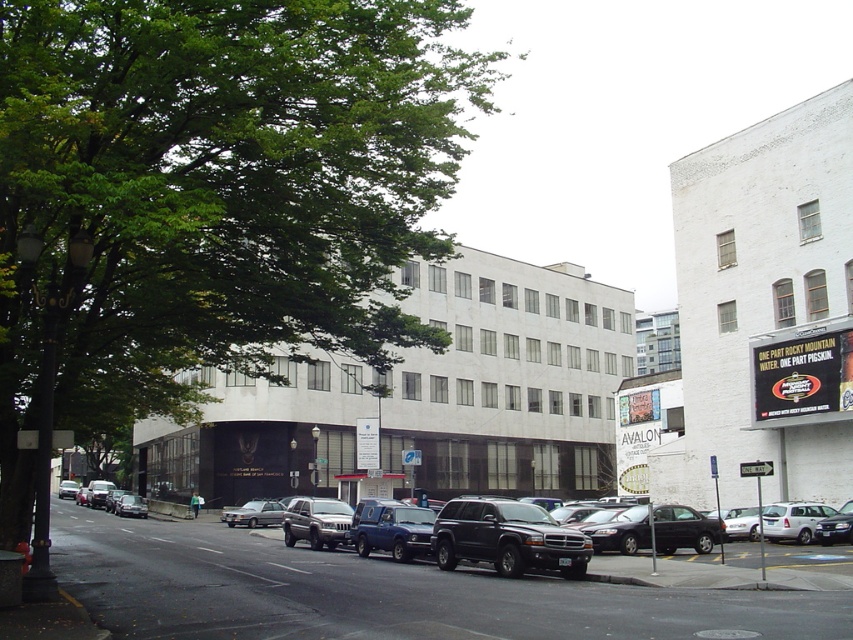
Which of these two, green leafy tree at upper left or shiny black sedan at center, stands taller?

With more height is green leafy tree at upper left.

Looking at this image, is green leafy tree at upper left thinner than shiny black sedan at center?

No.

Where is `green leafy tree at upper left`? This screenshot has height=640, width=853. green leafy tree at upper left is located at coordinates (212, 193).

At what (x,y) coordinates should I click in order to perform the action: click on green leafy tree at upper left. Please return your answer as a coordinate pair (x, y). Looking at the image, I should click on (212, 193).

Can you confirm if shiny black sedan at center is taller than silver metallic sedan at center?

No, shiny black sedan at center is not taller than silver metallic sedan at center.

Does shiny black sedan at center appear on the left side of silver metallic sedan at center?

Incorrect, shiny black sedan at center is not on the left side of silver metallic sedan at center.

Does point (590, 525) come behind point (245, 508)?

That is False.

Locate an element on the screen. shiny black sedan at center is located at coordinates (683, 529).

Does green leafy tree at upper left have a larger size compared to silver metallic sedan at center?

Indeed, green leafy tree at upper left has a larger size compared to silver metallic sedan at center.

Is point (9, 19) farther from camera compared to point (259, 515)?

No, it is not.

This screenshot has width=853, height=640. I want to click on green leafy tree at upper left, so click(x=212, y=193).